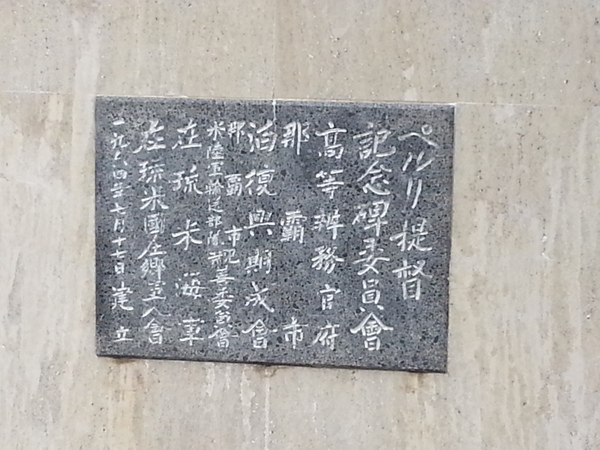
At what (x,y) coordinates should I click in order to perform the action: click on square tile. Please return your answer as a coordinate pair (x, y). The width and height of the screenshot is (600, 450). Looking at the image, I should click on (541, 318).